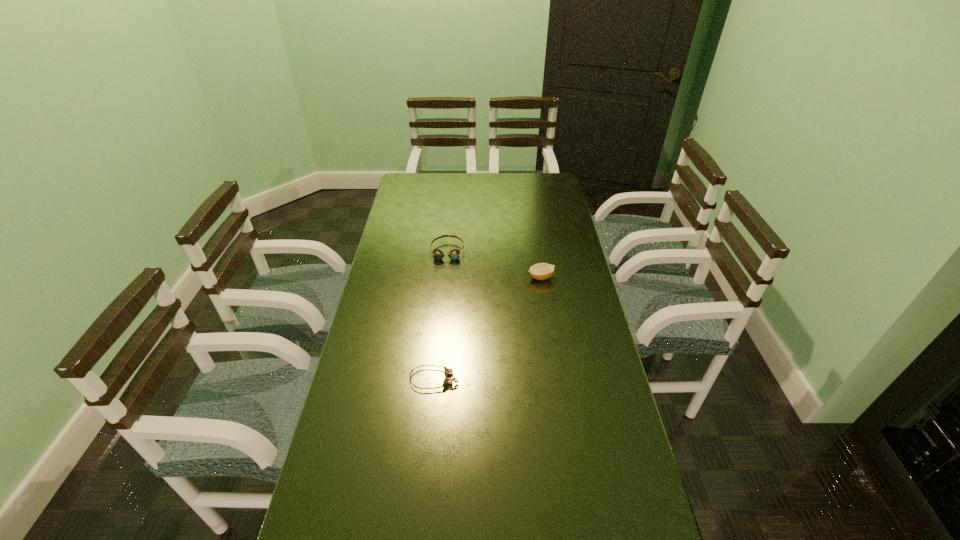
At what (x,y) coordinates should I click in order to perform the action: click on free spot that satisfies the following two spatial constraints: 1. through the lenses of the second farthest object; 2. on the right side of the farther goggles. Please return your answer as a coordinate pair (x, y). The image size is (960, 540). Looking at the image, I should click on (445, 277).

This screenshot has height=540, width=960. What are the coordinates of `vacant position in the image that satisfies the following two spatial constraints: 1. on the front side of the rightmost object; 2. on the front lenses and sides of the nearer goggles` in the screenshot? It's located at (557, 379).

Find the location of a particular element. The width and height of the screenshot is (960, 540). vacant point that satisfies the following two spatial constraints: 1. through the lenses of the second nearest object; 2. on the right side of the farther goggles is located at coordinates (445, 277).

In order to click on vacant space that satisfies the following two spatial constraints: 1. through the lenses of the farther goggles; 2. on the right side of the second nearest object in this screenshot , I will do [445, 277].